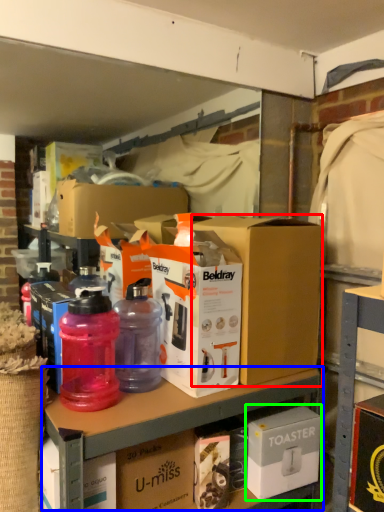
Question: Which object is positioned farthest from box (highlighted by a red box)? Select from workbench (highlighted by a blue box) and box (highlighted by a green box).

Choices:
 (A) workbench
 (B) box

Answer: (B)